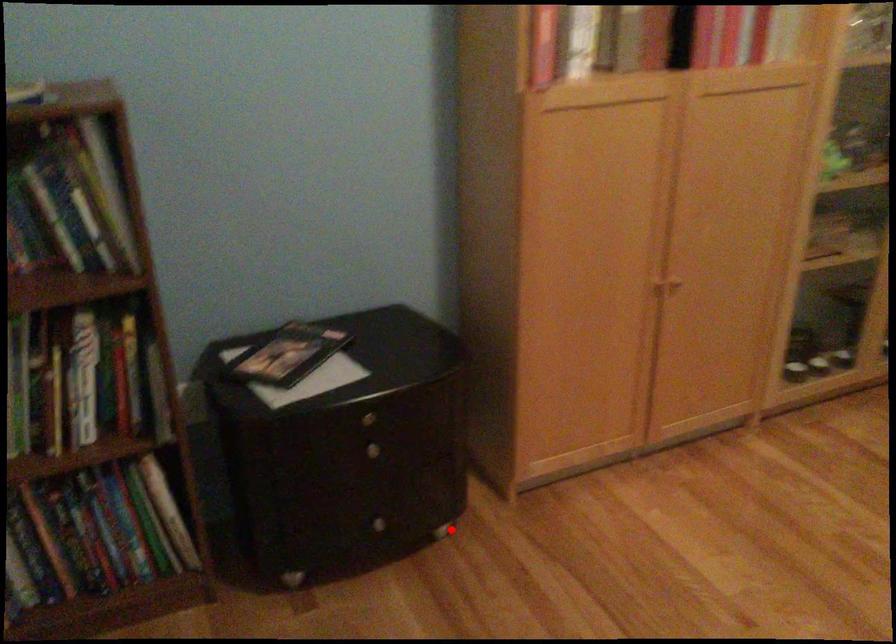
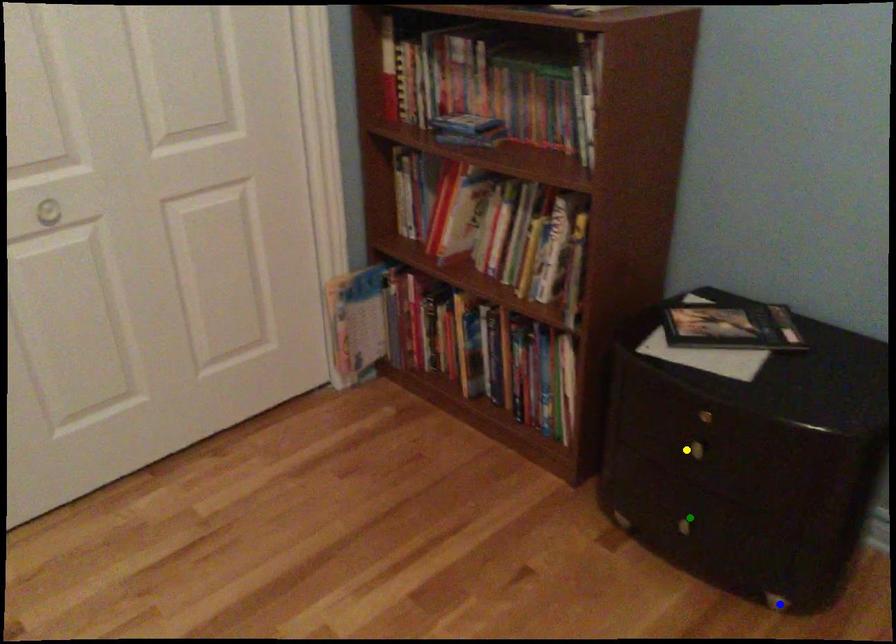
Question: I am providing you with two images of the same scene from different viewpoints. A red point is marked on the first image. You are given multiple points on the second image. Which spot in image 2 lines up with the point in image 1?

Choices:
 (A) yellow point
 (B) blue point
 (C) green point

Answer: (B)